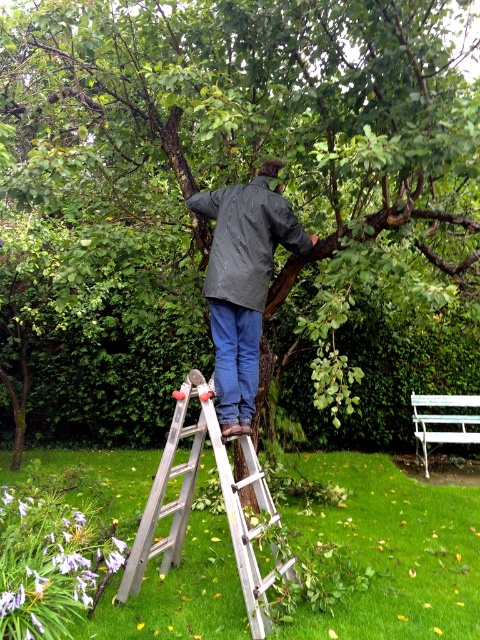
You are a drone operator trying to capture a photo of the green rough bark tree at upper center. The drone is currently at the origin point. What are the coordinates you should input to position the drone directly above the tree?

The coordinates to position the drone directly above the green rough bark tree at upper center are 0.294 in the x direction and 0.477 in the y direction.

You are standing at the point labeled as point (228,188) in the image. Looking around, you see a green rough bark tree at upper center. What is directly in front of you at that point?

The green rough bark tree at upper center is directly in front of you at point (228,188).